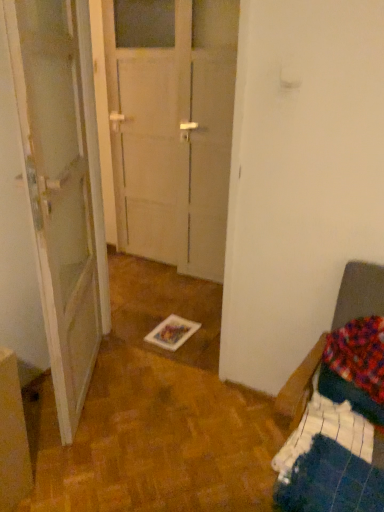
The width and height of the screenshot is (384, 512). Describe the element at coordinates (341, 410) in the screenshot. I see `dark blue fabric bed at right` at that location.

This screenshot has width=384, height=512. Identify the location of white glossy door at left. (62, 187).

From the image's perspective, is dark blue fabric bed at right on transparent glass door at center?

No.

Could you tell me if dark blue fabric bed at right is facing transparent glass door at center?

No, dark blue fabric bed at right is not facing towards transparent glass door at center.

From a real-world perspective, is dark blue fabric bed at right above or below transparent glass door at center?

From a real-world perspective, dark blue fabric bed at right is physically below transparent glass door at center.

Which is nearer, (382,460) or (216,273)?

Positioned in front is point (382,460).

Which is closer to the camera, (118, 244) or (9, 26)?

The point (9, 26) is more forward.

Considering the positions of objects transparent glass door at center and white glossy door at left in the image provided, who is in front, transparent glass door at center or white glossy door at left?

Positioned in front is white glossy door at left.

Would you say transparent glass door at center is outside white glossy door at left?

Yes.

From a real-world perspective, does transparent glass door at center sit lower than white glossy door at left?

Yes.

Considering the relative sizes of white glossy door at left and dark blue fabric bed at right in the image provided, is white glossy door at left thinner than dark blue fabric bed at right?

Yes.

Is dark blue fabric bed at right at the back of white glossy door at left?

No.

Which of these two, transparent glass door at center or dark blue fabric bed at right, is smaller?

transparent glass door at center.

Choose the correct answer: Is transparent glass door at center inside dark blue fabric bed at right or outside it?

transparent glass door at center is spatially situated outside dark blue fabric bed at right.

From the image's perspective, which one is positioned higher, transparent glass door at center or dark blue fabric bed at right?

transparent glass door at center appears higher in the image.

Is transparent glass door at center with dark blue fabric bed at right?

transparent glass door at center and dark blue fabric bed at right are clearly separated.

From a real-world perspective, which is physically above, white glossy door at left or transparent glass door at center?

From a 3D spatial view, white glossy door at left is above.

Between point (61, 178) and point (216, 242), which one is positioned in front?

The point (61, 178) is closer.

From the image's perspective, between white glossy door at left and transparent glass door at center, which one is located above?

transparent glass door at center is shown above in the image.

Considering the points (352, 387) and (66, 41), which point is behind, point (352, 387) or point (66, 41)?

The point (66, 41) is more distant.

From the image's perspective, is dark blue fabric bed at right beneath white glossy door at left?

Yes, from the image's perspective, dark blue fabric bed at right is beneath white glossy door at left.

Image resolution: width=384 pixels, height=512 pixels. I want to click on barn door above the dark blue fabric bed at right (from a real-world perspective), so click(62, 187).

This screenshot has width=384, height=512. I want to click on glass door that is above the dark blue fabric bed at right (from the image's perspective), so click(x=172, y=127).

Identify the location of glass door behind the white glossy door at left. This screenshot has width=384, height=512. (172, 127).

When comparing their distances from white glossy door at left, does dark blue fabric bed at right or transparent glass door at center seem further?

dark blue fabric bed at right is further to white glossy door at left.

Which object lies further to the anchor point dark blue fabric bed at right, transparent glass door at center or white glossy door at left?

The object further to dark blue fabric bed at right is transparent glass door at center.

Considering their positions, is white glossy door at left positioned closer to transparent glass door at center than dark blue fabric bed at right?

white glossy door at left lies closer to transparent glass door at center than the other object.

Looking at this image, based on their spatial positions, is white glossy door at left or transparent glass door at center further from dark blue fabric bed at right?

transparent glass door at center.

From the image, which object appears to be farther from white glossy door at left, transparent glass door at center or dark blue fabric bed at right?

dark blue fabric bed at right.

Looking at the image, which one is located closer to transparent glass door at center, dark blue fabric bed at right or white glossy door at left?

white glossy door at left.

Image resolution: width=384 pixels, height=512 pixels. What are the coordinates of `glass door between white glossy door at left and dark blue fabric bed at right in the horizontal direction` in the screenshot? It's located at (172, 127).